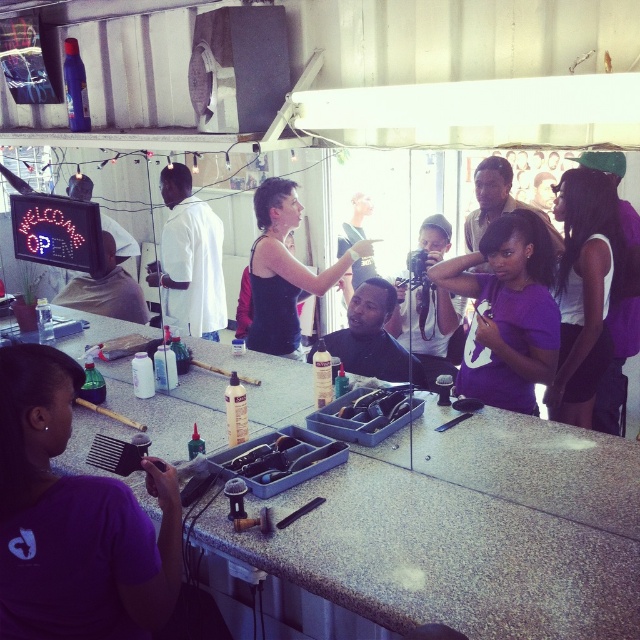
You are a customer in the barbershop and you see two items on the counter, the purple matte shirt at center and the black matte tank top at center. Which one is more to the right?

The purple matte shirt at center is positioned on the right side of black matte tank top at center, so the purple matte shirt at center is more to the right.